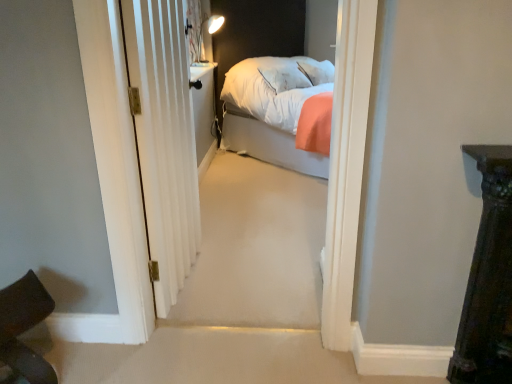
Question: Is dark brown leather chair at lower left wider or thinner than white textured door at center?

Choices:
 (A) thin
 (B) wide

Answer: (B)

Question: Based on their sizes in the image, would you say dark brown leather chair at lower left is bigger or smaller than white textured door at center?

Choices:
 (A) big
 (B) small

Answer: (B)

Question: From a real-world perspective, is dark brown leather chair at lower left physically located above or below white textured door at center?

Choices:
 (A) below
 (B) above

Answer: (A)

Question: Would you say white textured door at center is to the left or to the right of dark brown leather chair at lower left in the picture?

Choices:
 (A) right
 (B) left

Answer: (A)

Question: From the image's perspective, is white textured door at center positioned above or below dark brown leather chair at lower left?

Choices:
 (A) below
 (B) above

Answer: (B)

Question: Choose the correct answer: Is white textured door at center inside dark brown leather chair at lower left or outside it?

Choices:
 (A) inside
 (B) outside

Answer: (B)

Question: In terms of height, does white textured door at center look taller or shorter compared to dark brown leather chair at lower left?

Choices:
 (A) short
 (B) tall

Answer: (B)